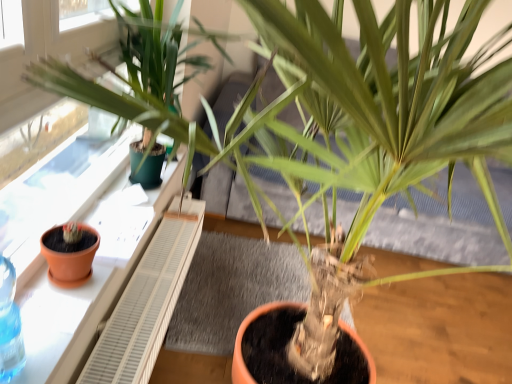
The image size is (512, 384). What are the coordinates of `terracotta clay pot at left` in the screenshot? It's located at click(70, 255).

The width and height of the screenshot is (512, 384). What do you see at coordinates (70, 255) in the screenshot?
I see `terracotta clay pot at left` at bounding box center [70, 255].

Measure the distance between point [90,235] and camera.

They are 1.09 meters apart.

The height and width of the screenshot is (384, 512). Describe the element at coordinates (88, 284) in the screenshot. I see `terracotta clay pot at left` at that location.

At what (x,y) coordinates should I click in order to perform the action: click on terracotta clay pot at left. Please return your answer as a coordinate pair (x, y). The width and height of the screenshot is (512, 384). Looking at the image, I should click on (88, 284).

You are a GUI agent. You are given a task and a screenshot of the screen. Output one action in this format:
    pyautogui.click(x=<x>, y=<y>)
    Task: Click on the terracotta clay pot at left
    This screenshot has height=384, width=512.
    Given the screenshot: What is the action you would take?
    pyautogui.click(x=70, y=255)

In the scene shown: Can you confirm if terracotta clay pot at left is positioned to the right of terracotta clay pot at left?

No, terracotta clay pot at left is not to the right of terracotta clay pot at left.

Is the position of terracotta clay pot at left less distant than that of terracotta clay pot at left?

Yes.

Does point (106, 203) lie in front of point (68, 266)?

No, it is not.

From the image's perspective, is terracotta clay pot at left on top of terracotta clay pot at left?

Indeed, from the image's perspective, terracotta clay pot at left is shown above terracotta clay pot at left.

From a real-world perspective, relative to terracotta clay pot at left, is terracotta clay pot at left vertically above or below?

terracotta clay pot at left is below terracotta clay pot at left.

Which of these two, terracotta clay pot at left or terracotta clay pot at left, is wider?

With larger width is terracotta clay pot at left.

Does terracotta clay pot at left have a lesser height compared to terracotta clay pot at left?

Correct, terracotta clay pot at left is not as tall as terracotta clay pot at left.

Looking at the image, does terracotta clay pot at left seem bigger or smaller compared to terracotta clay pot at left?

terracotta clay pot at left is bigger than terracotta clay pot at left.

Is terracotta clay pot at left not inside terracotta clay pot at left?

terracotta clay pot at left lies outside terracotta clay pot at left's area.

Is terracotta clay pot at left placed right next to terracotta clay pot at left?

terracotta clay pot at left is not next to terracotta clay pot at left, and they're not touching.

Is terracotta clay pot at left oriented towards terracotta clay pot at left?

No, terracotta clay pot at left is not turned towards terracotta clay pot at left.

Can you tell me how much terracotta clay pot at left and terracotta clay pot at left differ in facing direction?

3.34 degrees separate the facing orientations of terracotta clay pot at left and terracotta clay pot at left.

Measure the distance from terracotta clay pot at left to terracotta clay pot at left.

terracotta clay pot at left is 6.87 inches from terracotta clay pot at left.

Identify the location of flowerpot above the terracotta clay pot at left (from a real-world perspective). The width and height of the screenshot is (512, 384). (70, 255).

Between terracotta clay pot at left and terracotta clay pot at left, which one appears on the right side from the viewer's perspective?

From the viewer's perspective, terracotta clay pot at left appears more on the right side.

Is terracotta clay pot at left further to the viewer compared to terracotta clay pot at left?

Yes, the depth of terracotta clay pot at left is greater than that of terracotta clay pot at left.

Considering the points (72, 267) and (160, 212), which point is behind, point (72, 267) or point (160, 212)?

The point (160, 212) is farther from the camera.

From the image's perspective, is terracotta clay pot at left beneath terracotta clay pot at left?

Correct, terracotta clay pot at left appears lower than terracotta clay pot at left in the image.

From a real-world perspective, does terracotta clay pot at left sit lower than terracotta clay pot at left?

Incorrect, from a real-world perspective, terracotta clay pot at left is higher than terracotta clay pot at left.

Is terracotta clay pot at left wider than terracotta clay pot at left?

Incorrect, the width of terracotta clay pot at left does not surpass that of terracotta clay pot at left.

Considering the sizes of objects terracotta clay pot at left and terracotta clay pot at left in the image provided, who is shorter, terracotta clay pot at left or terracotta clay pot at left?

terracotta clay pot at left.

Is terracotta clay pot at left smaller than terracotta clay pot at left?

Indeed, terracotta clay pot at left has a smaller size compared to terracotta clay pot at left.

Is terracotta clay pot at left inside the boundaries of terracotta clay pot at left, or outside?

terracotta clay pot at left is not enclosed by terracotta clay pot at left.

Are terracotta clay pot at left and terracotta clay pot at left located far from each other?

No.

Is terracotta clay pot at left looking in the opposite direction of terracotta clay pot at left?

terracotta clay pot at left does not have its back to terracotta clay pot at left.

This screenshot has height=384, width=512. I want to click on window sill in front of the terracotta clay pot at left, so click(x=88, y=284).

I want to click on flowerpot lying below the terracotta clay pot at left (from the image's perspective), so click(x=70, y=255).

Where is `window sill above the terracotta clay pot at left (from the image's perspective)`? window sill above the terracotta clay pot at left (from the image's perspective) is located at coordinates (88, 284).